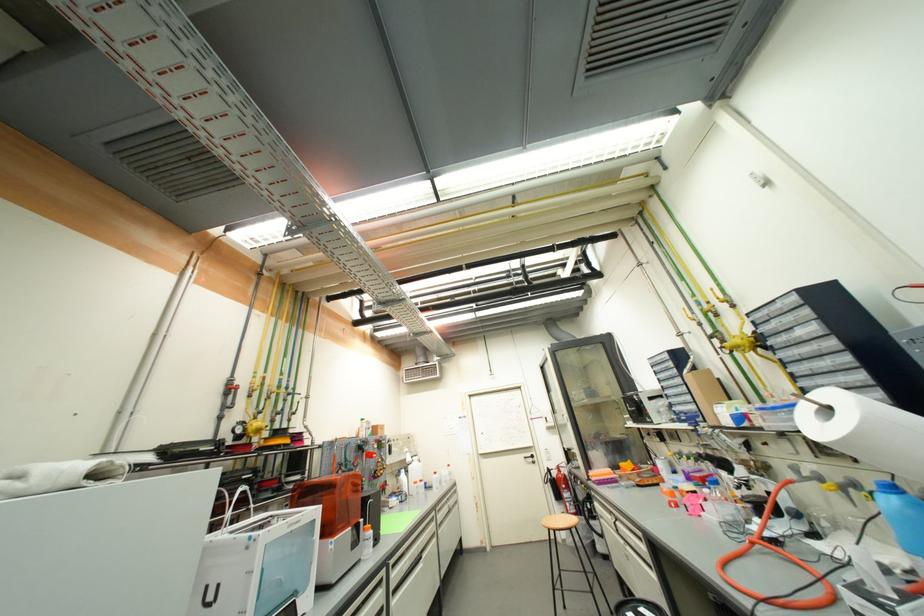
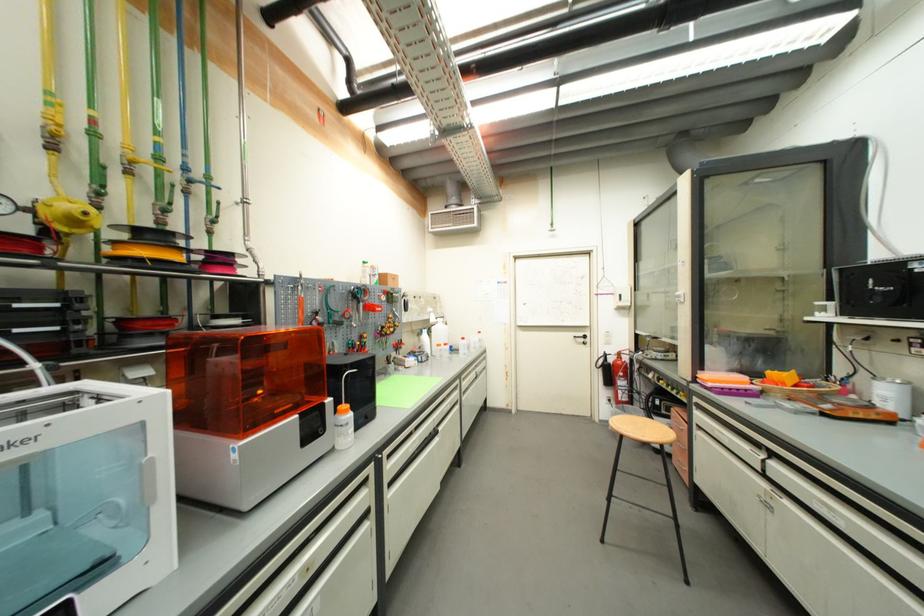
Find the pixel in the second image that matches (x=372, y=528) in the first image.

(349, 408)